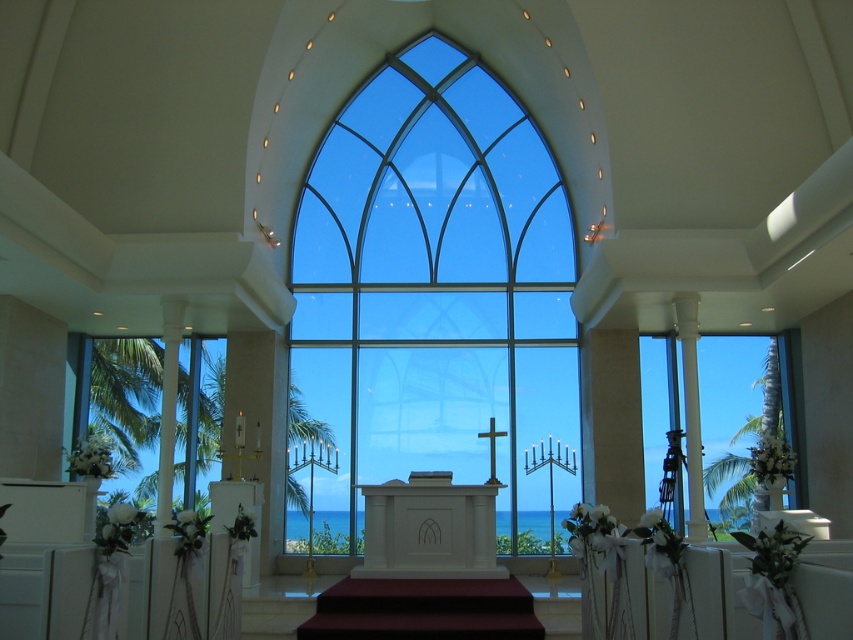
You are an architect evaluating the chapel design. You need to install a new lighting fixture that requires a minimum of 3 meters of vertical space. Based on the image, which window should you choose to place it near, the transparent glass window at center or the clear glass window at left?

The clear glass window at left is taller than the transparent glass window at center. Since the clear glass window at left is taller, it likely provides the required vertical space of 3 meters needed for the lighting fixture installation.

Based on the photo, you are planning to install a new decorative element in the chapel. You have two options for placement locations based on the size of the transparent glass window at center and the transparent glass window at right. Which window would be more suitable for a larger decoration?

The transparent glass window at right is larger, so it would be more suitable for a larger decoration.